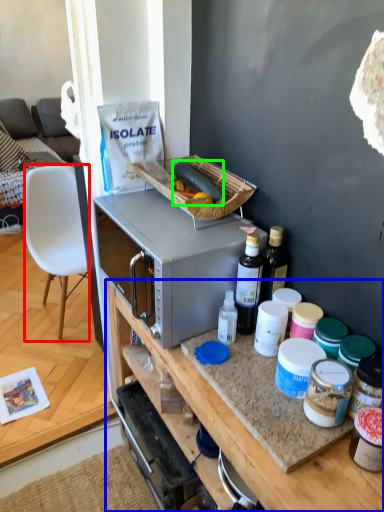
Question: Estimate the real-world distances between objects in this image. Which object is closer to chair (highlighted by a red box), desk (highlighted by a blue box) or food (highlighted by a green box)?

Choices:
 (A) desk
 (B) food

Answer: (B)